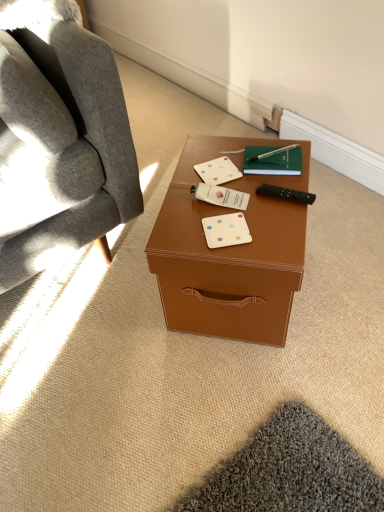
The height and width of the screenshot is (512, 384). What are the coordinates of `vacant region in front of brown leather desk at center` in the screenshot? It's located at (243, 410).